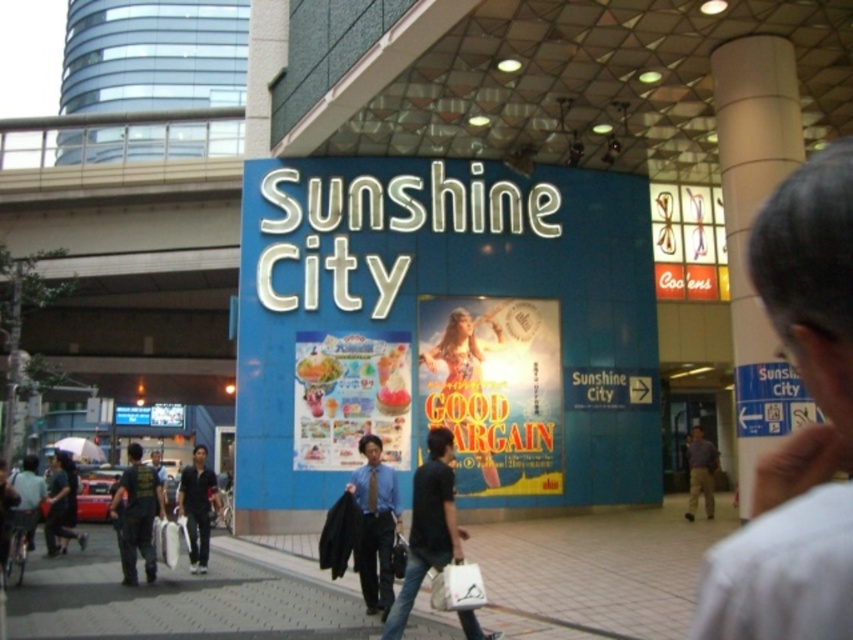
How far apart are blue glossy signboard at center and light brown shirt at center?

The distance of blue glossy signboard at center from light brown shirt at center is 13.93 meters.

Locate an element on the screen. blue glossy signboard at center is located at coordinates (440, 294).

The height and width of the screenshot is (640, 853). What are the coordinates of `blue glossy signboard at center` in the screenshot? It's located at [x=440, y=294].

Which is behind, point (496, 637) or point (689, 515)?

Point (689, 515)

Is point (437, 454) positioned after point (709, 492)?

No, (437, 454) is in front of (709, 492).

Identify the location of black matte jacket at center. This screenshot has width=853, height=640. (428, 525).

Is point (260, 356) closer to viewer compared to point (476, 570)?

No, it is not.

Is blue glossy signboard at center to the left of white fabric bag at center from the viewer's perspective?

Incorrect, blue glossy signboard at center is not on the left side of white fabric bag at center.

Between point (488, 209) and point (448, 593), which one is positioned in front?

Point (448, 593)

This screenshot has height=640, width=853. In order to click on blue glossy signboard at center in this screenshot , I will do (x=440, y=294).